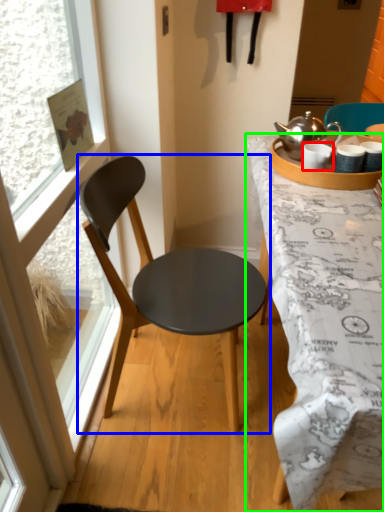
Question: Which object is the farthest from coffee cup (highlighted by a red box)? Choose among these: chair (highlighted by a blue box) or desk (highlighted by a green box).

Choices:
 (A) chair
 (B) desk

Answer: (A)